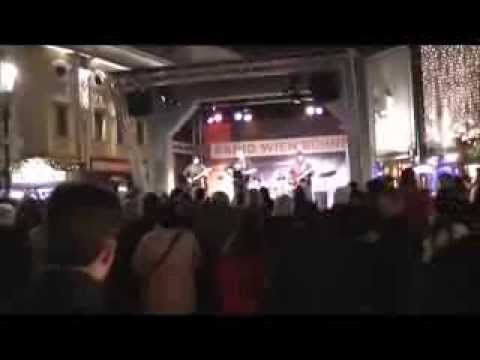
You are a GUI agent. You are given a task and a screenshot of the screen. Output one action in this format:
    pyautogui.click(x=<x>, y=<y>)
    Task: Click on the light
    This screenshot has height=360, width=480.
    Given the screenshot: What is the action you would take?
    pyautogui.click(x=307, y=108)